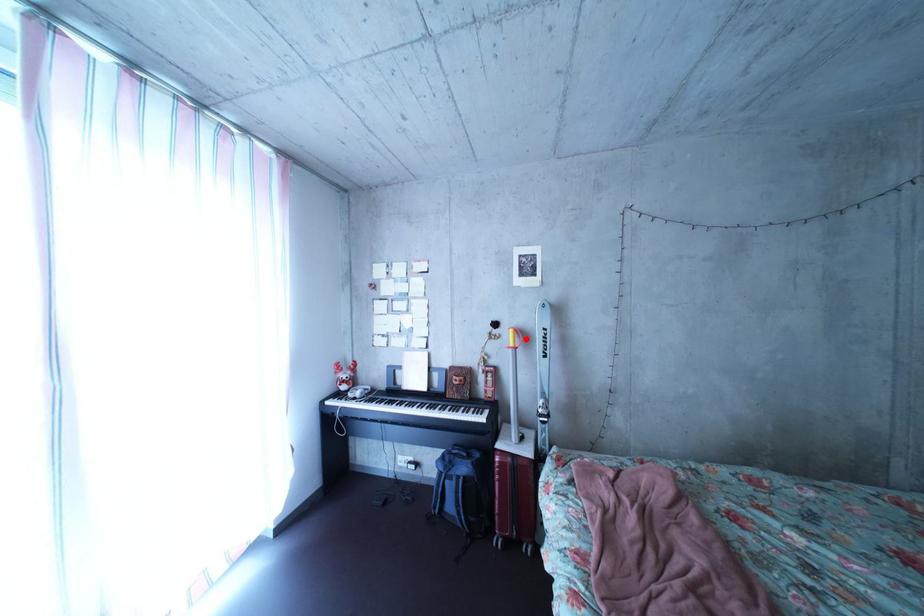
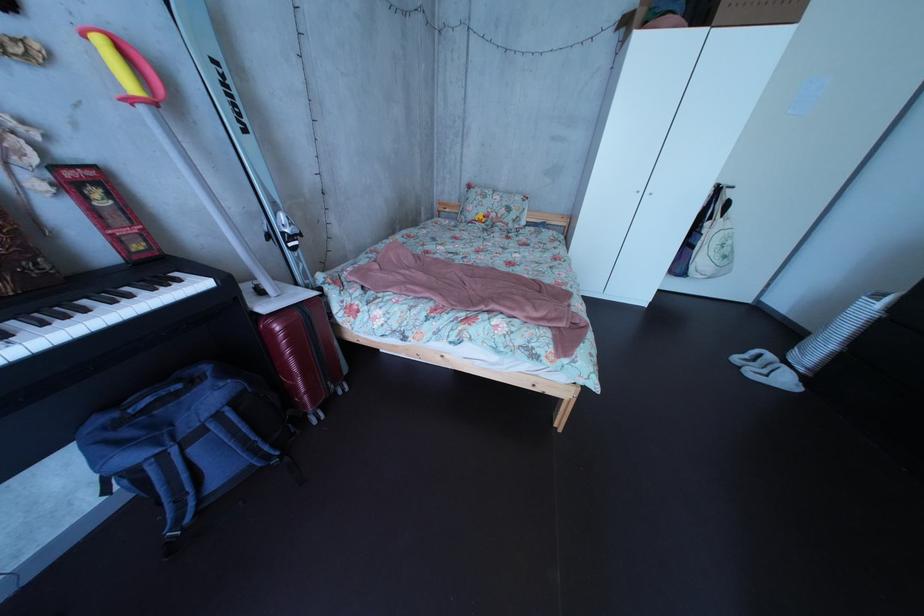
Find the pixel in the second image that matches the highlighted location in the first image.

(116, 51)